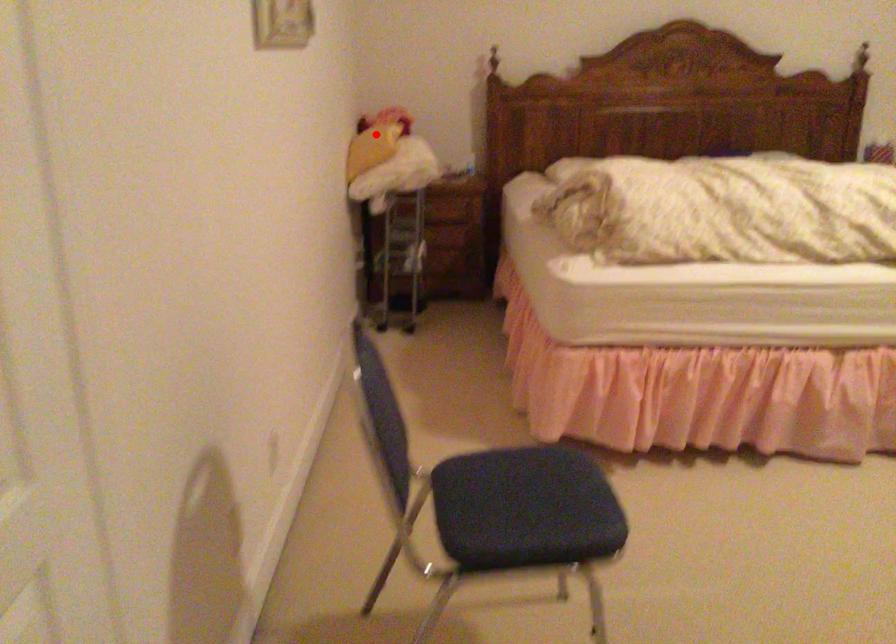
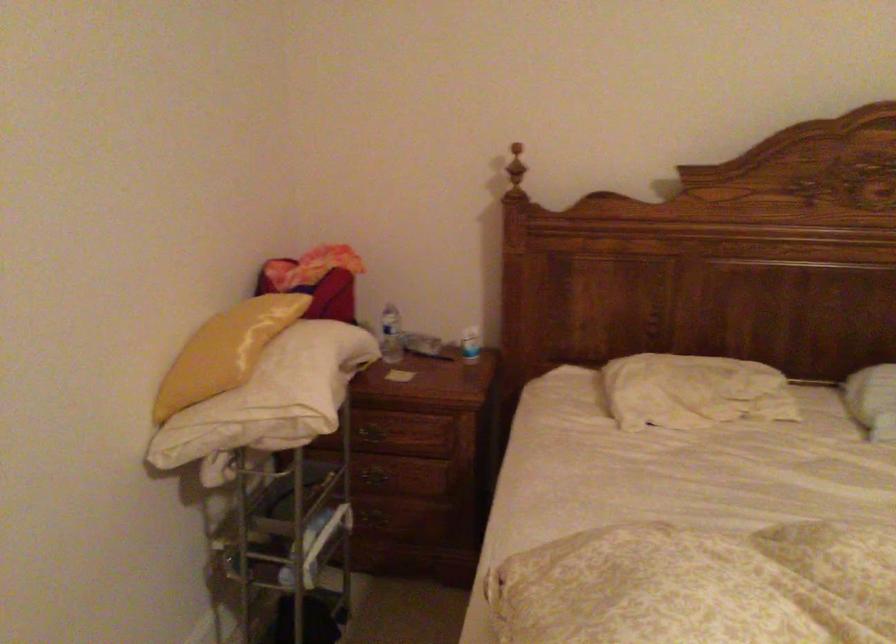
Where in the second image is the point corresponding to the highlighted location from the first image?

(225, 351)